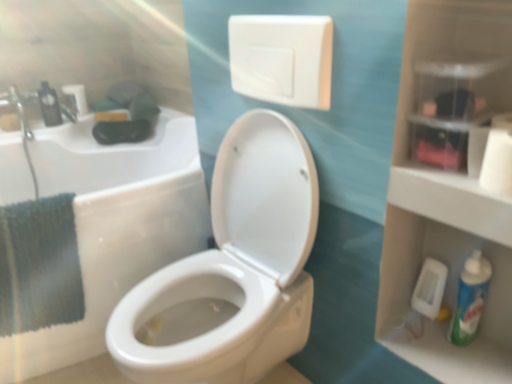
Question: Is white matte toilet paper at left, arranged as the third toilet paper when viewed from the right, at the back of white matte toilet paper at upper left, arranged as the third toilet paper when ordered from the bottom?

Choices:
 (A) yes
 (B) no

Answer: (B)

Question: Considering the relative positions of white matte toilet paper at upper left, placed as the 2th toilet paper when sorted from left to right, and white matte toilet paper at left, acting as the first toilet paper starting from the left, in the image provided, is white matte toilet paper at upper left, placed as the 2th toilet paper when sorted from left to right, to the left of white matte toilet paper at left, acting as the first toilet paper starting from the left, from the viewer's perspective?

Choices:
 (A) no
 (B) yes

Answer: (A)

Question: Can you confirm if white matte toilet paper at upper left, the first toilet paper from the top, is taller than white matte toilet paper at left, the second toilet paper in the front-to-back sequence?

Choices:
 (A) yes
 (B) no

Answer: (A)

Question: Could you tell me if white matte toilet paper at upper left, the first toilet paper from the top, is turned towards white matte toilet paper at left, the 2th toilet paper positioned from the top?

Choices:
 (A) no
 (B) yes

Answer: (A)

Question: Is white matte toilet paper at upper left, the first toilet paper from the top, smaller than white matte toilet paper at left, which is counted as the second toilet paper, starting from the back?

Choices:
 (A) no
 (B) yes

Answer: (A)

Question: From a real-world perspective, is white plastic toilet bowl cleaner at lower right physically located above or below black plastic mouthwash at left, the 2th mouthwash positioned from the right?

Choices:
 (A) above
 (B) below

Answer: (B)

Question: Relative to black plastic mouthwash at left, arranged as the first mouthwash when viewed from the left, is white plastic toilet bowl cleaner at lower right in front or behind?

Choices:
 (A) behind
 (B) front

Answer: (B)

Question: From the image's perspective, is white plastic toilet bowl cleaner at lower right positioned above or below black plastic mouthwash at left, arranged as the first mouthwash when viewed from the left?

Choices:
 (A) above
 (B) below

Answer: (B)

Question: In terms of height, does white plastic toilet bowl cleaner at lower right look taller or shorter compared to black plastic mouthwash at left, the 2th mouthwash positioned from the right?

Choices:
 (A) tall
 (B) short

Answer: (B)

Question: Would you say black plastic mouthwash at left, acting as the first mouthwash starting from the top, is to the left or to the right of white glossy toilet at center in the picture?

Choices:
 (A) right
 (B) left

Answer: (B)

Question: From the image's perspective, is black plastic mouthwash at left, arranged as the first mouthwash when viewed from the left, located above or below white glossy toilet at center?

Choices:
 (A) above
 (B) below

Answer: (A)

Question: Would you say black plastic mouthwash at left, arranged as the first mouthwash when viewed from the left, is inside or outside white glossy toilet at center?

Choices:
 (A) inside
 (B) outside

Answer: (B)

Question: Based on their sizes in the image, would you say black plastic mouthwash at left, acting as the 1th mouthwash starting from the back, is bigger or smaller than white glossy toilet at center?

Choices:
 (A) big
 (B) small

Answer: (B)

Question: Considering the positions of white matte toilet paper at upper left, arranged as the third toilet paper when ordered from the bottom, and teal fabric towel at left in the image, is white matte toilet paper at upper left, arranged as the third toilet paper when ordered from the bottom, bigger or smaller than teal fabric towel at left?

Choices:
 (A) small
 (B) big

Answer: (A)

Question: Considering the relative positions of white matte toilet paper at upper left, the 3th toilet paper when ordered from front to back, and teal fabric towel at left in the image provided, is white matte toilet paper at upper left, the 3th toilet paper when ordered from front to back, to the left or to the right of teal fabric towel at left?

Choices:
 (A) left
 (B) right

Answer: (A)